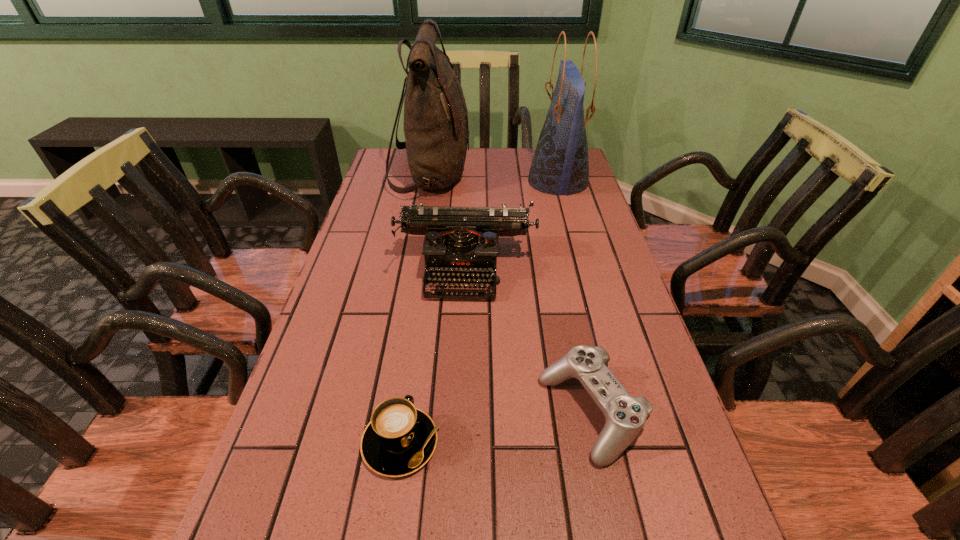
Where is `vacant space located 0.050m on the right of the control`? The height and width of the screenshot is (540, 960). vacant space located 0.050m on the right of the control is located at coordinates (666, 414).

This screenshot has width=960, height=540. I want to click on backpack at the far edge, so click(x=436, y=130).

I want to click on shopping bag present at the far edge, so click(x=560, y=165).

Find the location of a particular element. This screenshot has height=540, width=960. backpack located at the left edge is located at coordinates (436, 130).

What are the coordinates of `typewriter that is at the left edge` in the screenshot? It's located at (460, 242).

Where is `cappuccino that is positioned at the left edge`? The image size is (960, 540). cappuccino that is positioned at the left edge is located at coordinates (400, 439).

Where is `shopping bag situated at the right edge`? The width and height of the screenshot is (960, 540). shopping bag situated at the right edge is located at coordinates (560, 165).

At what (x,y) coordinates should I click in order to perform the action: click on control present at the right edge. Please return your answer as a coordinate pair (x, y). Looking at the image, I should click on (625, 416).

Identify the location of object at the far left corner. This screenshot has height=540, width=960. (436, 130).

Where is `object present at the far right corner`? Image resolution: width=960 pixels, height=540 pixels. object present at the far right corner is located at coordinates (560, 165).